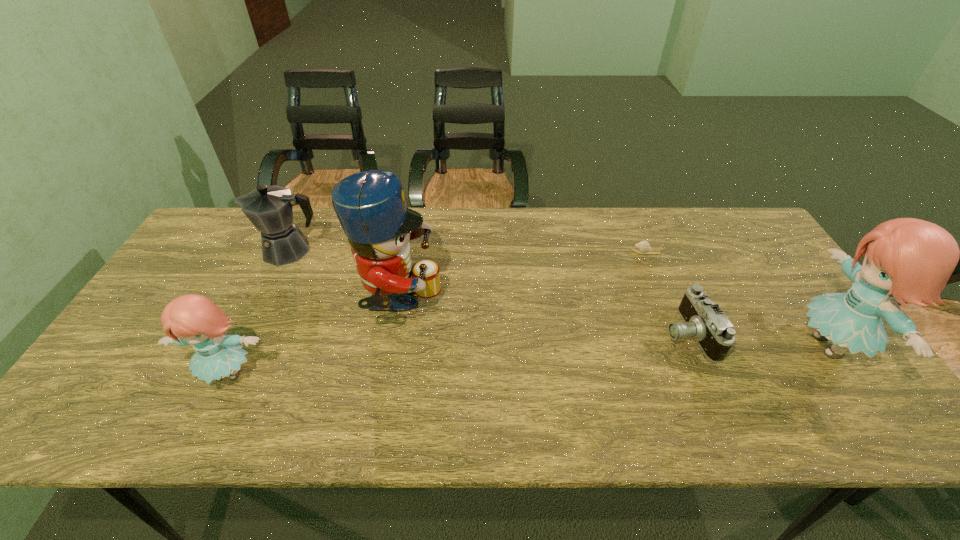
To make them evenly spaced by inserting another doll among them, please locate a vacant spot for this new doll. Please provide its 2D coordinates. Your answer should be formatted as a tuple, i.e. [(x, y)], where the tuple contains the x and y coordinates of a point satisfying the conditions above.

[(537, 359)]